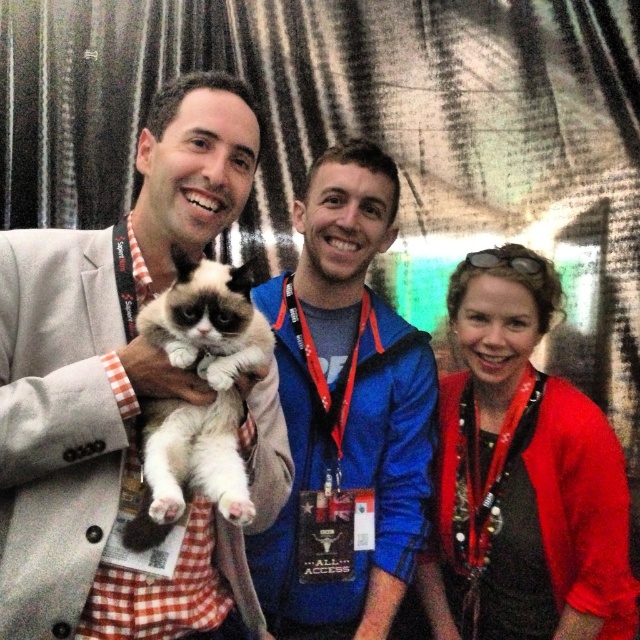
Question: Is blue fleece jacket at center behind matte red cardigan at center?

Choices:
 (A) yes
 (B) no

Answer: (A)

Question: Considering the relative positions of light gray suit at center and blue fleece jacket at center in the image provided, where is light gray suit at center located with respect to blue fleece jacket at center?

Choices:
 (A) left
 (B) right

Answer: (A)

Question: Estimate the real-world distances between objects in this image. Which object is closer to the light gray suit at center?

Choices:
 (A) matte red cardigan at center
 (B) white fluffy cat at center

Answer: (B)

Question: Which of these objects is positioned closest to the blue fleece jacket at center?

Choices:
 (A) white fluffy cat at center
 (B) matte red cardigan at center

Answer: (B)

Question: Which point appears farthest from the camera in this image?

Choices:
 (A) (550, 483)
 (B) (148, 160)
 (C) (147, 412)
 (D) (314, 584)

Answer: (D)

Question: Does light gray suit at center come behind blue fleece jacket at center?

Choices:
 (A) no
 (B) yes

Answer: (A)